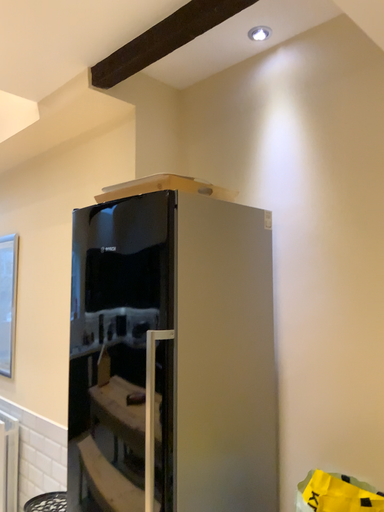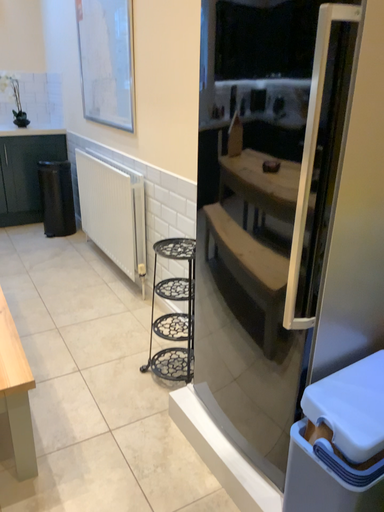
Question: How did the camera likely rotate when shooting the video?

Choices:
 (A) rotated downward
 (B) rotated upward

Answer: (A)